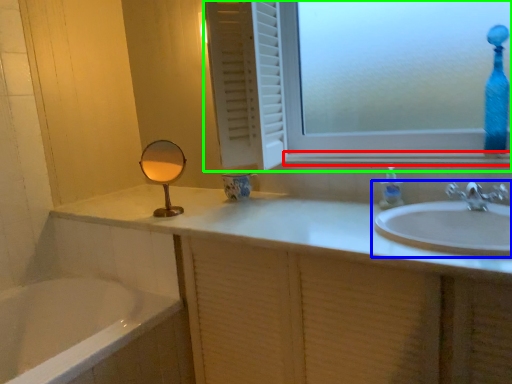
Question: Which is farther away from window sill (highlighted by a red box)? sink (highlighted by a blue box) or window (highlighted by a green box)?

Choices:
 (A) sink
 (B) window

Answer: (A)